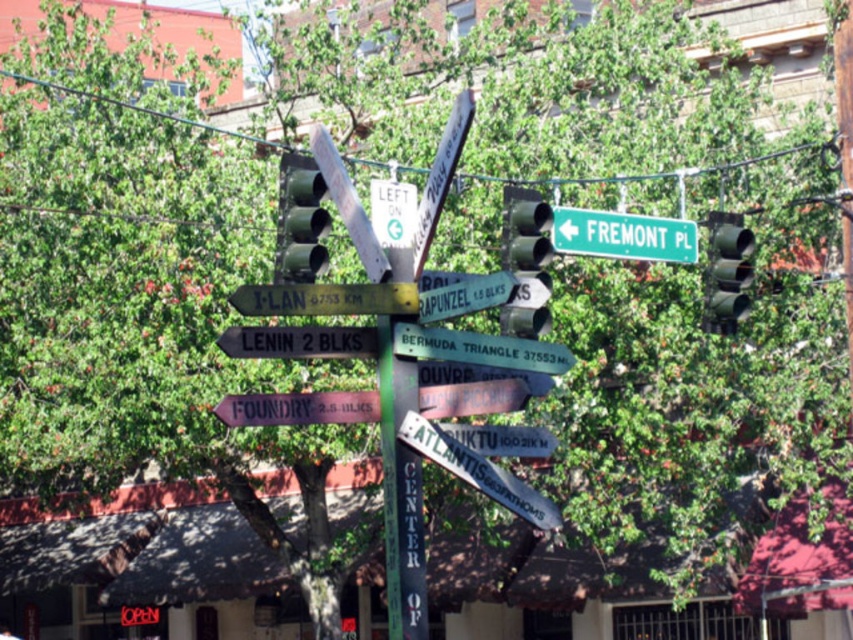
Who is lower down, white plastic street sign at center or metallic silver sign at center?

metallic silver sign at center

From the picture: Who is taller, white plastic street sign at center or metallic silver sign at center?

white plastic street sign at center

Which is in front, point (546, 356) or point (486, 436)?

Point (546, 356) is more forward.

Where is `white plastic street sign at center`? white plastic street sign at center is located at coordinates (480, 348).

Does point (279, 420) come farther from viewer compared to point (526, 372)?

No, (279, 420) is in front of (526, 372).

The width and height of the screenshot is (853, 640). In order to click on brown wooden sign at lower center in this screenshot , I will do `click(299, 408)`.

The height and width of the screenshot is (640, 853). What do you see at coordinates (300, 220) in the screenshot?
I see `green matte traffic light at upper center` at bounding box center [300, 220].

Can you confirm if green matte traffic light at upper center is taller than metallic silver sign at center?

Yes.

What are the coordinates of `green matte traffic light at upper center` in the screenshot? It's located at (300, 220).